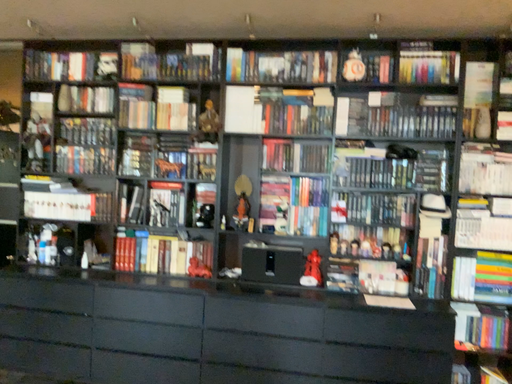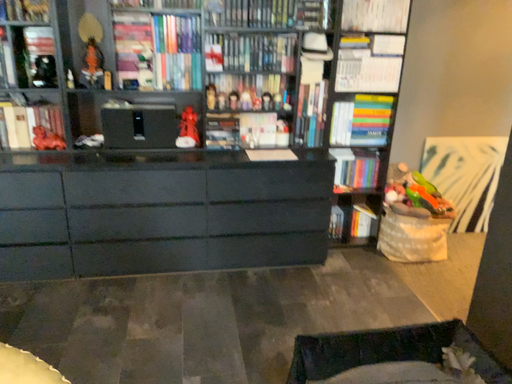
Question: Which way did the camera rotate in the video?

Choices:
 (A) rotated left
 (B) rotated right

Answer: (B)